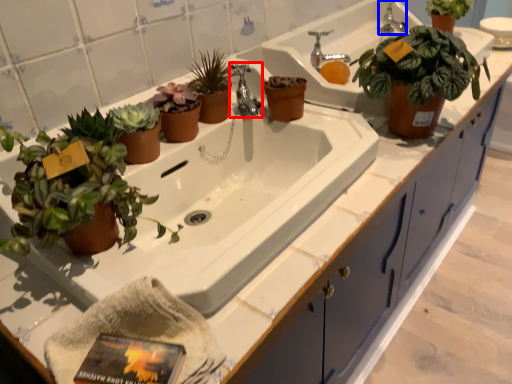
Question: Which object appears closest to the camera in this image, tap (highlighted by a red box) or faucet (highlighted by a blue box)?

Choices:
 (A) tap
 (B) faucet

Answer: (A)